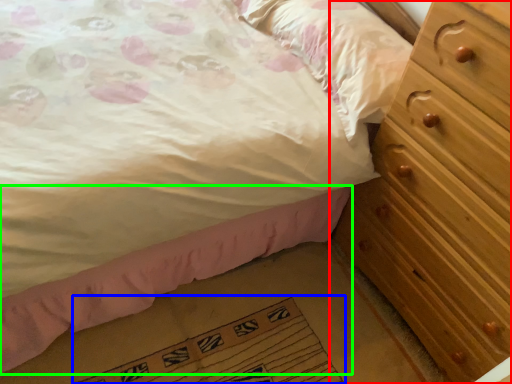
Question: Estimate the real-world distances between objects in this image. Which object is closer to chest of drawers (highlighted by a red box), doormat (highlighted by a blue box) or bed frame (highlighted by a green box)?

Choices:
 (A) doormat
 (B) bed frame

Answer: (B)